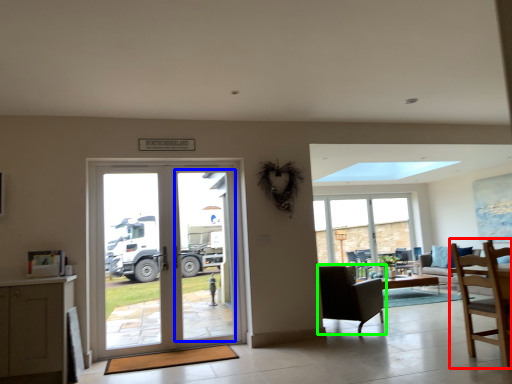
Question: Which object is the farthest from chair (highlighted by a red box)? Choose among these: screen door (highlighted by a blue box) or chair (highlighted by a green box).

Choices:
 (A) screen door
 (B) chair

Answer: (A)